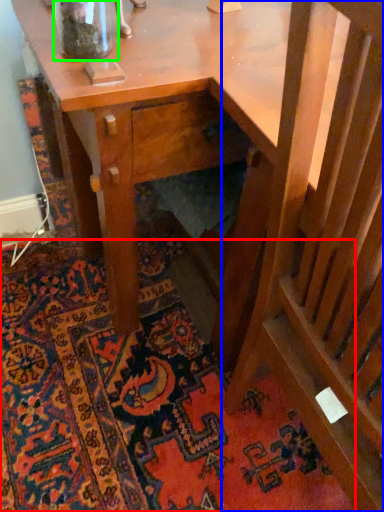
Question: Considering the real-world distances, which object is farthest from mat (highlighted by a red box)? rocking chair (highlighted by a blue box) or glass vase (highlighted by a green box)?

Choices:
 (A) rocking chair
 (B) glass vase

Answer: (B)